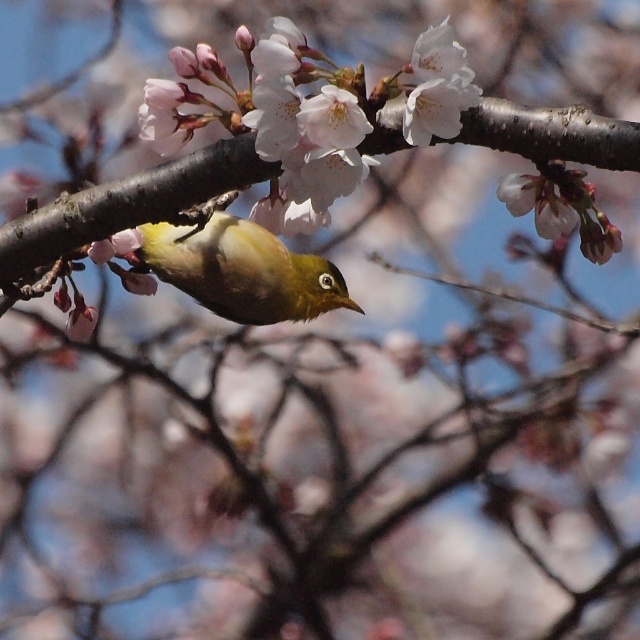
Question: Is green matte bird at center thinner than smooth white petal at center?

Choices:
 (A) yes
 (B) no

Answer: (B)

Question: Does green matte bird at center appear under smooth white petal at center?

Choices:
 (A) yes
 (B) no

Answer: (A)

Question: Does green matte bird at center have a greater width compared to smooth white petal at center?

Choices:
 (A) no
 (B) yes

Answer: (B)

Question: Which of the following is the closest to the observer?

Choices:
 (A) green matte bird at center
 (B) smooth white petal at center

Answer: (B)